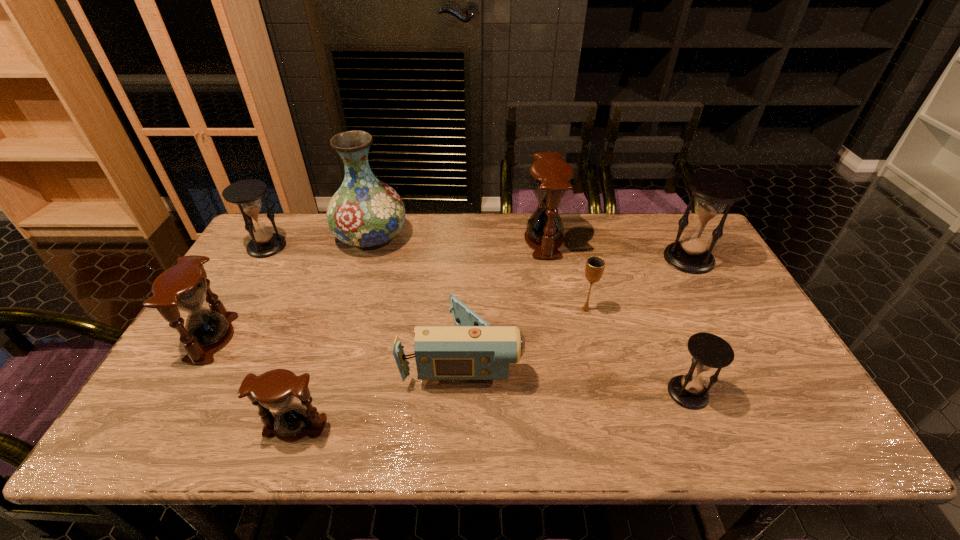
This screenshot has width=960, height=540. Identify the location of camcorder. coord(473,350).

At what (x,y) coordinates should I click in order to perform the action: click on the second object from right to left. Please return your answer as a coordinate pair (x, y). The height and width of the screenshot is (540, 960). Looking at the image, I should click on point(709,351).

Where is `the second hourglass from right to left`? The height and width of the screenshot is (540, 960). the second hourglass from right to left is located at coordinates (709, 351).

The width and height of the screenshot is (960, 540). In order to click on the third hourglass from left to right in this screenshot , I will do `click(276, 389)`.

Locate an element on the screen. the nearest hourglass is located at coordinates [276, 389].

This screenshot has width=960, height=540. I want to click on free space located on the left of the blue vase, so click(320, 237).

The height and width of the screenshot is (540, 960). What are the coordinates of `free space located on the front of the farthest brown hourglass` in the screenshot? It's located at (550, 273).

What are the coordinates of `free space located 0.100m on the front of the biggest black hourglass` in the screenshot? It's located at (709, 298).

Find the location of a particular element. The image size is (960, 540). free space located 0.110m on the front of the leftmost black hourglass is located at coordinates (247, 281).

I want to click on blank space located 0.330m on the back of the second smallest brown hourglass, so click(x=269, y=242).